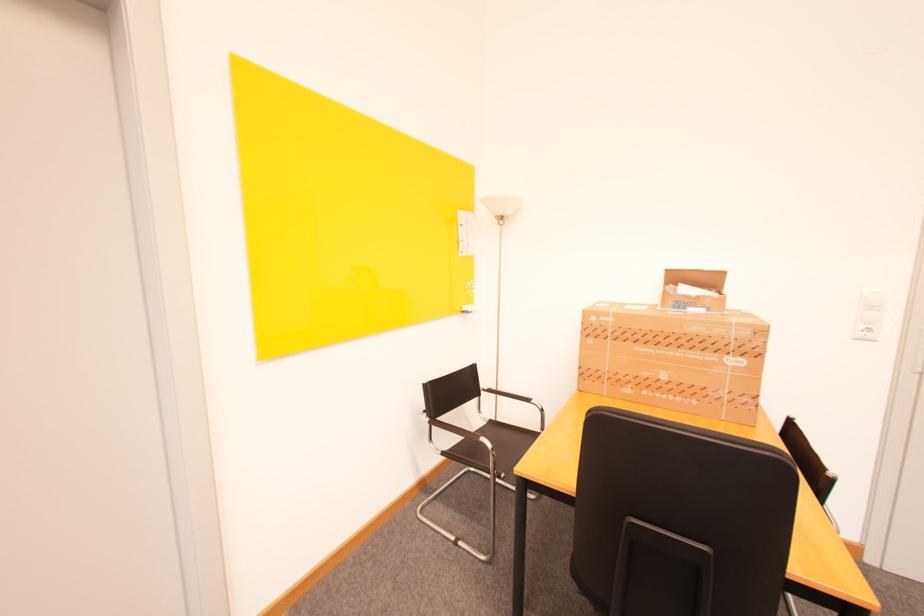
Where would you push the white light switch? Please return your answer as a coordinate pair (x, y).

(869, 315)